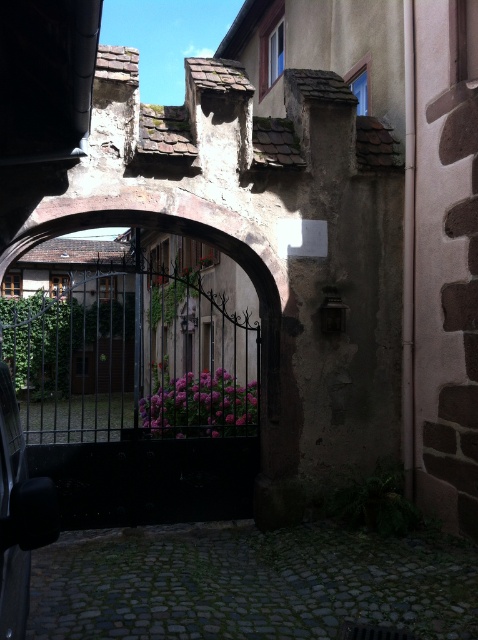
Question: Among these points, which one is farthest from the camera?

Choices:
 (A) (402, 604)
 (B) (12, 564)
 (C) (215, 348)

Answer: (C)

Question: Where is black wrought iron gate at center located in relation to shiny black car at lower left in the image?

Choices:
 (A) above
 (B) below

Answer: (A)

Question: Does black wrought iron gate at center appear on the right side of shiny black car at lower left?

Choices:
 (A) yes
 (B) no

Answer: (B)

Question: Does black wrought iron gate at center have a larger size compared to shiny black car at lower left?

Choices:
 (A) yes
 (B) no

Answer: (A)

Question: Among these objects, which one is nearest to the camera?

Choices:
 (A) gray cobblestone alley at lower center
 (B) shiny black car at lower left
 (C) black wrought iron gate at center

Answer: (B)

Question: Which object is closer to the camera taking this photo?

Choices:
 (A) gray cobblestone alley at lower center
 (B) black wrought iron gate at center

Answer: (A)